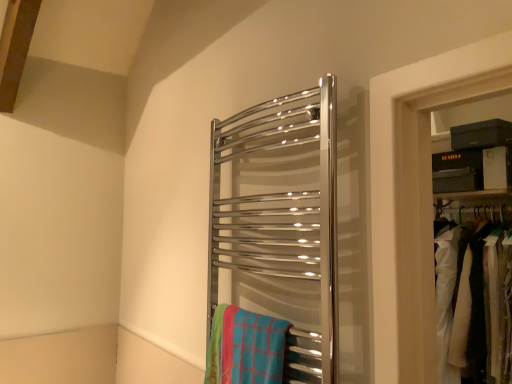
Question: Could you tell me if polished chrome towel rack at center is facing blue plaid beach towel at center?

Choices:
 (A) no
 (B) yes

Answer: (B)

Question: Is blue plaid beach towel at center located within polished chrome towel rack at center?

Choices:
 (A) yes
 (B) no

Answer: (A)

Question: Considering the relative sizes of polished chrome towel rack at center and blue plaid beach towel at center in the image provided, is polished chrome towel rack at center wider than blue plaid beach towel at center?

Choices:
 (A) yes
 (B) no

Answer: (A)

Question: Is polished chrome towel rack at center to the left of blue plaid beach towel at center from the viewer's perspective?

Choices:
 (A) no
 (B) yes

Answer: (A)

Question: From the image's perspective, is polished chrome towel rack at center on blue plaid beach towel at center?

Choices:
 (A) yes
 (B) no

Answer: (A)

Question: Are polished chrome towel rack at center and blue plaid beach towel at center located far from each other?

Choices:
 (A) no
 (B) yes

Answer: (A)

Question: Is polished chrome towel rack at center located within white fabric at right?

Choices:
 (A) no
 (B) yes

Answer: (A)

Question: Considering the relative sizes of white fabric at right and polished chrome towel rack at center in the image provided, is white fabric at right thinner than polished chrome towel rack at center?

Choices:
 (A) no
 (B) yes

Answer: (A)

Question: Considering the relative sizes of white fabric at right and polished chrome towel rack at center in the image provided, is white fabric at right wider than polished chrome towel rack at center?

Choices:
 (A) no
 (B) yes

Answer: (B)

Question: Is white fabric at right bigger than polished chrome towel rack at center?

Choices:
 (A) yes
 (B) no

Answer: (A)

Question: From the image's perspective, is white fabric at right beneath polished chrome towel rack at center?

Choices:
 (A) yes
 (B) no

Answer: (A)

Question: Is white fabric at right next to polished chrome towel rack at center and touching it?

Choices:
 (A) no
 (B) yes

Answer: (A)

Question: Does polished chrome towel rack at center have a lesser height compared to white fabric at right?

Choices:
 (A) no
 (B) yes

Answer: (A)